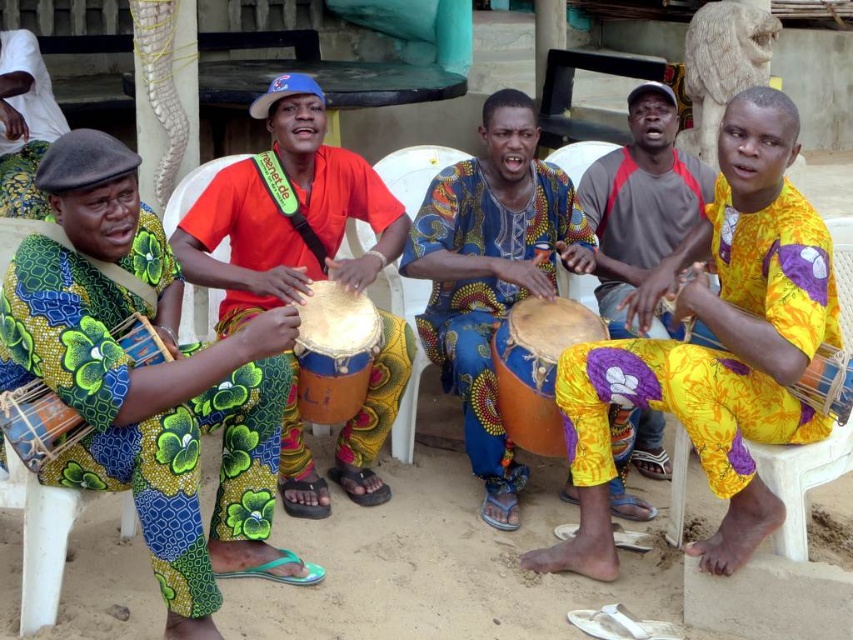
Question: Is green floral fabric drum at left above yellow printed pants at center?

Choices:
 (A) no
 (B) yes

Answer: (A)

Question: Considering the real-world distances, which object is closest to the blue patterned cloth at center?

Choices:
 (A) yellow printed pants at right
 (B) green floral fabric drum at left
 (C) matte wooden drum at center

Answer: (C)

Question: Is yellow printed pants at right below yellow printed pants at center?

Choices:
 (A) yes
 (B) no

Answer: (A)

Question: Based on their relative distances, which object is farther from the blue patterned cloth at center?

Choices:
 (A) orange drum at center
 (B) yellow printed pants at center
 (C) orange fabric drum at center

Answer: (A)

Question: Can you confirm if green floral fabric drum at left is smaller than matte wooden drum at center?

Choices:
 (A) yes
 (B) no

Answer: (B)

Question: Which object is farther from the camera taking this photo?

Choices:
 (A) yellow printed pants at right
 (B) yellow printed pants at center
 (C) orange fabric drum at center
 (D) green floral fabric drum at left

Answer: (B)